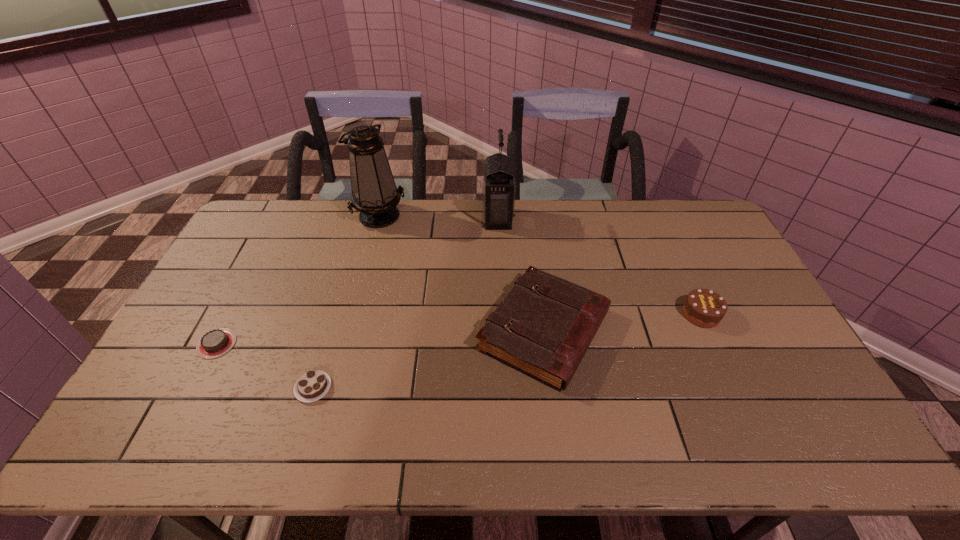
Locate an element on the screen. This screenshot has width=960, height=540. oil lamp is located at coordinates (374, 193).

Locate an element on the screen. The height and width of the screenshot is (540, 960). lantern is located at coordinates (499, 189).

Locate an element on the screen. the tallest chocolate cake is located at coordinates (704, 308).

The height and width of the screenshot is (540, 960). Identify the location of the rightmost chocolate cake. (704, 308).

Find the location of a particular element. The image size is (960, 540). hardback book is located at coordinates (544, 326).

I want to click on the nearest chocolate cake, so click(313, 385).

Image resolution: width=960 pixels, height=540 pixels. Identify the location of the leftmost chocolate cake. (215, 343).

You are a GUI agent. You are given a task and a screenshot of the screen. Output one action in this format:
    pyautogui.click(x=<x>, y=<y>)
    Task: Click on the leftmost object
    The height and width of the screenshot is (540, 960).
    Given the screenshot: What is the action you would take?
    215,343

Find the location of `vacant area situated on the left of the oil lamp`. vacant area situated on the left of the oil lamp is located at coordinates (300, 215).

This screenshot has width=960, height=540. Find the location of `free location located on the front-facing side of the lantern`. free location located on the front-facing side of the lantern is located at coordinates (410, 219).